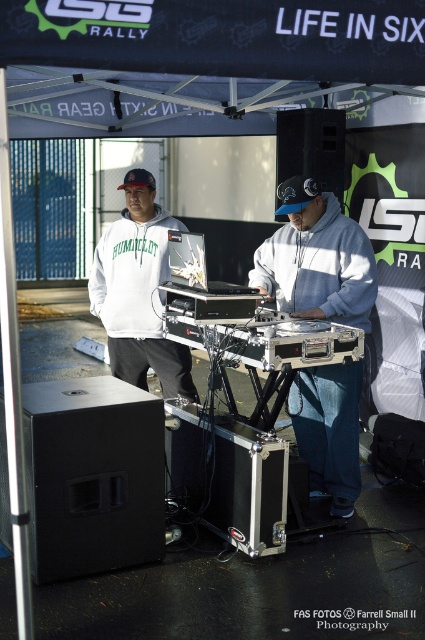
You are organizing a charity event and need to decide which hoodie to use for promotional material. The gray matte hoodie at center and the white matte hoodie at center are both options. Based on their sizes, which one would you choose if you want the hoodie to be more prominent in the photo?

The white matte hoodie at center is larger, so it would be more prominent in the photo.

You are at an event and want to take a photo of the DJ setup. There are two hoodies visible in the center of the image. The gray matte hoodie at center and the white matte hoodie at center. Which hoodie should you focus on to ensure the other is still partially visible in the frame?

The gray matte hoodie at center is positioned over white matte hoodie at center, so focusing on the gray matte hoodie at center will allow the white matte hoodie at center to be partially visible behind it.

You are organizing a clothing donation drive and need to determine which hoodie can fit into a standard donation box that requires items to be no thicker than 4 inches. According to the scene, which hoodie between the gray matte hoodie at center and the white matte hoodie at center is more likely to meet the thickness requirement?

The gray matte hoodie at center is thinner than the white matte hoodie at center, so the gray matte hoodie at center is more likely to meet the thickness requirement of the donation box.